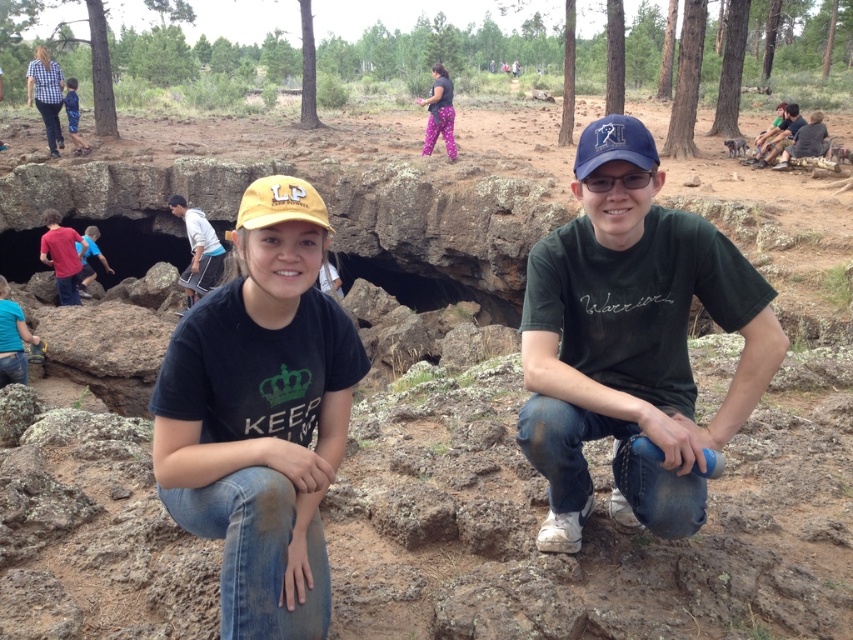
Question: Which point is farther from the camera taking this photo?

Choices:
 (A) pos(70,97)
 (B) pos(85,282)
 (C) pos(207,284)

Answer: (A)

Question: Where is yellow fabric baseball cap at center located in relation to blue denim shorts at lower left in the image?

Choices:
 (A) left
 (B) right

Answer: (B)

Question: Does green matte t-shirt at center appear over blue shirt at lower left?

Choices:
 (A) no
 (B) yes

Answer: (A)

Question: Which point appears farthest from the camera in this image?

Choices:
 (A) (73, 92)
 (B) (618, 128)
 (C) (347, 401)
 (D) (219, 253)

Answer: (A)

Question: Is green matte t-shirt at center positioned in front of blue shirt at lower left?

Choices:
 (A) no
 (B) yes

Answer: (B)

Question: Which point is farther to the camera?

Choices:
 (A) blue shirt at lower left
 (B) black matte t-shirt at center
 (C) blue fabric baseball cap at center

Answer: (A)